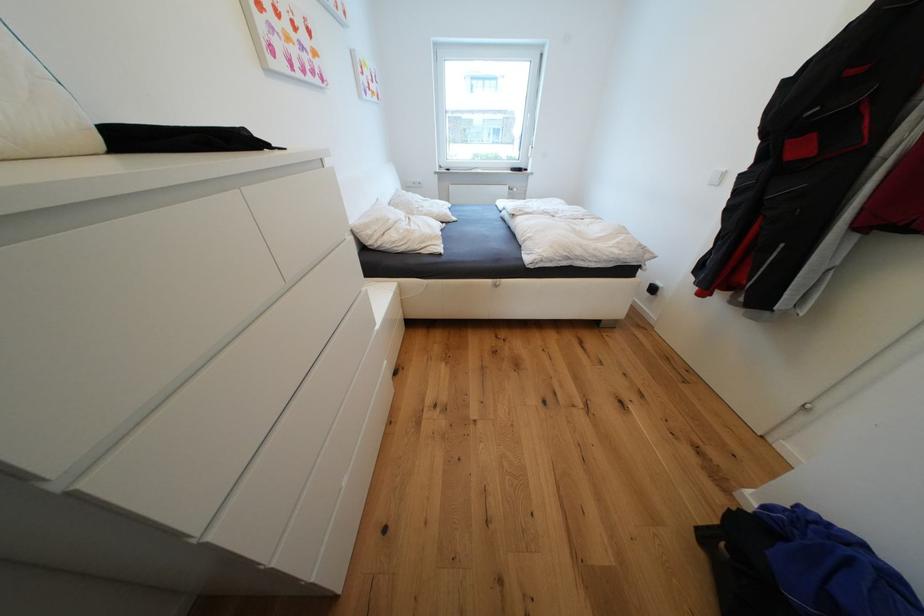
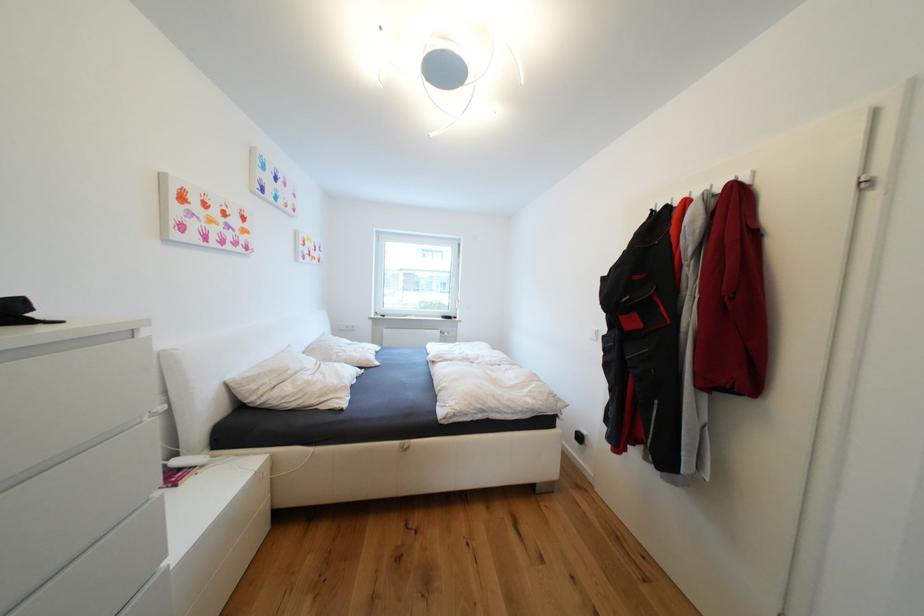
The point at (x=403, y=224) is marked in the first image. Where is the corresponding point in the second image?

(304, 374)